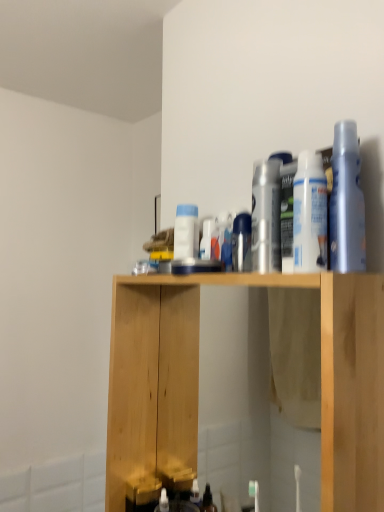
Question: Which direction should I rotate to face white glossy spray can at center, which is counted as the first cleaning product, starting from the left, — up or down?

Choices:
 (A) down
 (B) up

Answer: (B)

Question: Can you confirm if white matte spray can at upper right, which ranks as the 2th cleaning product in right-to-left order, is positioned to the left of satin silver spray can at center?

Choices:
 (A) yes
 (B) no

Answer: (B)

Question: Is white matte spray can at upper right, which ranks as the third cleaning product in back-to-front order, not close to satin silver spray can at center?

Choices:
 (A) no
 (B) yes

Answer: (A)

Question: From the image's perspective, would you say white matte spray can at upper right, which ranks as the third cleaning product in back-to-front order, is positioned over satin silver spray can at center?

Choices:
 (A) yes
 (B) no

Answer: (A)

Question: From a real-world perspective, is white matte spray can at upper right, marked as the 2th cleaning product in a front-to-back arrangement, below satin silver spray can at center?

Choices:
 (A) yes
 (B) no

Answer: (B)

Question: Can you confirm if white matte spray can at upper right, marked as the 2th cleaning product in a front-to-back arrangement, is smaller than satin silver spray can at center?

Choices:
 (A) yes
 (B) no

Answer: (B)

Question: Is white matte spray can at upper right, marked as the 2th cleaning product in a front-to-back arrangement, surrounding satin silver spray can at center?

Choices:
 (A) yes
 (B) no

Answer: (B)

Question: From a real-world perspective, is natural wood cabinet at center physically below white glossy spray can at center, the 4th cleaning product when ordered from front to back?

Choices:
 (A) yes
 (B) no

Answer: (A)

Question: From the image's perspective, does natural wood cabinet at center appear higher than white glossy spray can at center, which appears as the fourth cleaning product when viewed from the right?

Choices:
 (A) yes
 (B) no

Answer: (B)

Question: Is natural wood cabinet at center wider than white glossy spray can at center, which is counted as the first cleaning product, starting from the left?

Choices:
 (A) no
 (B) yes

Answer: (B)

Question: Is natural wood cabinet at center touching white glossy spray can at center, which appears as the fourth cleaning product when viewed from the right?

Choices:
 (A) yes
 (B) no

Answer: (B)

Question: Considering the relative sizes of natural wood cabinet at center and white glossy spray can at center, the 4th cleaning product when ordered from front to back, in the image provided, is natural wood cabinet at center taller than white glossy spray can at center, the 4th cleaning product when ordered from front to back,?

Choices:
 (A) no
 (B) yes

Answer: (B)

Question: Considering the relative sizes of natural wood cabinet at center and white glossy spray can at center, which appears as the fourth cleaning product when viewed from the right, in the image provided, is natural wood cabinet at center bigger than white glossy spray can at center, which appears as the fourth cleaning product when viewed from the right,?

Choices:
 (A) yes
 (B) no

Answer: (A)

Question: Is satin silver spray can at center bigger than white glossy spray can at center, which appears as the fourth cleaning product when viewed from the right?

Choices:
 (A) yes
 (B) no

Answer: (B)